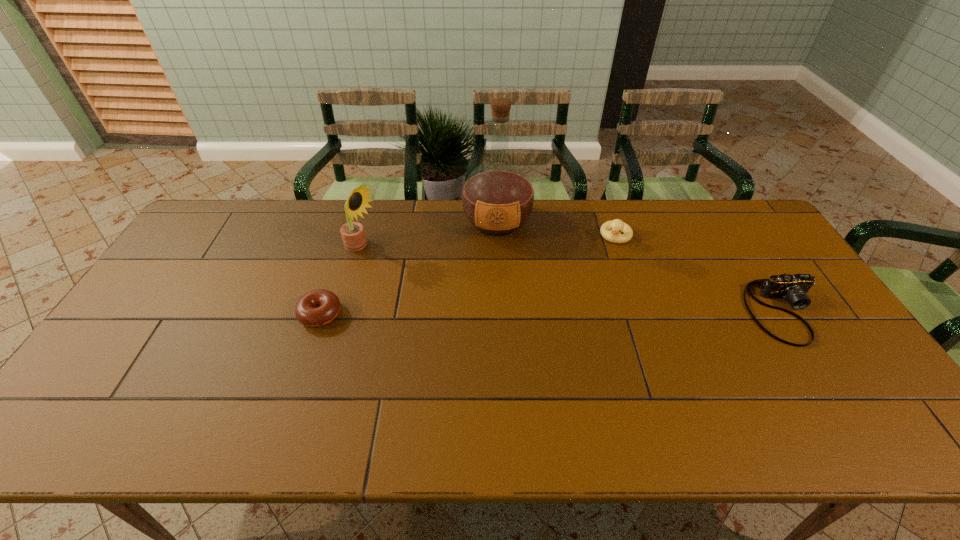
Find the location of a particular element. free spot on the desktop that is between the doughnut and the fourth tallest object and is positioned at the beak of the second object from right to left is located at coordinates coord(582,313).

Locate an element on the screen. The height and width of the screenshot is (540, 960). free space on the desktop that is between the doughnut and the rightmost object and is positioned on the front label of the third object from right to left is located at coordinates (495, 313).

At what (x,y) coordinates should I click in order to perform the action: click on vacant space on the desktop that is between the doughnut and the second shortest object and is positioned on the face of the sunflower. Please return your answer as a coordinate pair (x, y). Image resolution: width=960 pixels, height=540 pixels. Looking at the image, I should click on (511, 313).